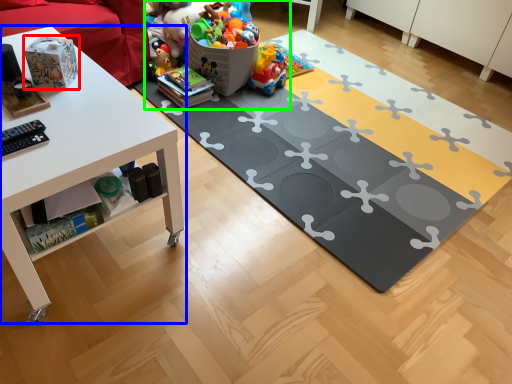
Question: Based on their relative distances, which object is nearer to toy (highlighted by a red box)? Choose from table (highlighted by a blue box) and toy (highlighted by a green box).

Choices:
 (A) table
 (B) toy

Answer: (A)